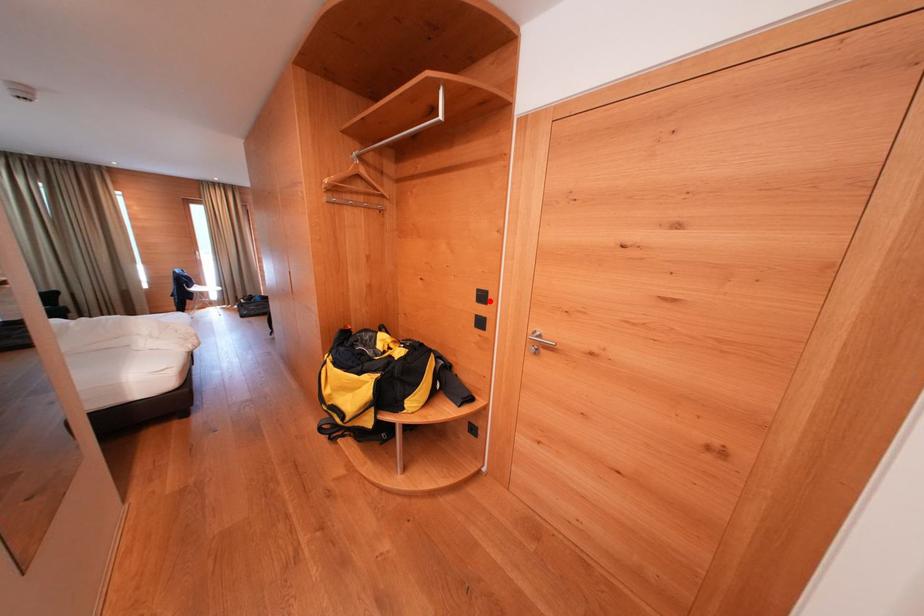
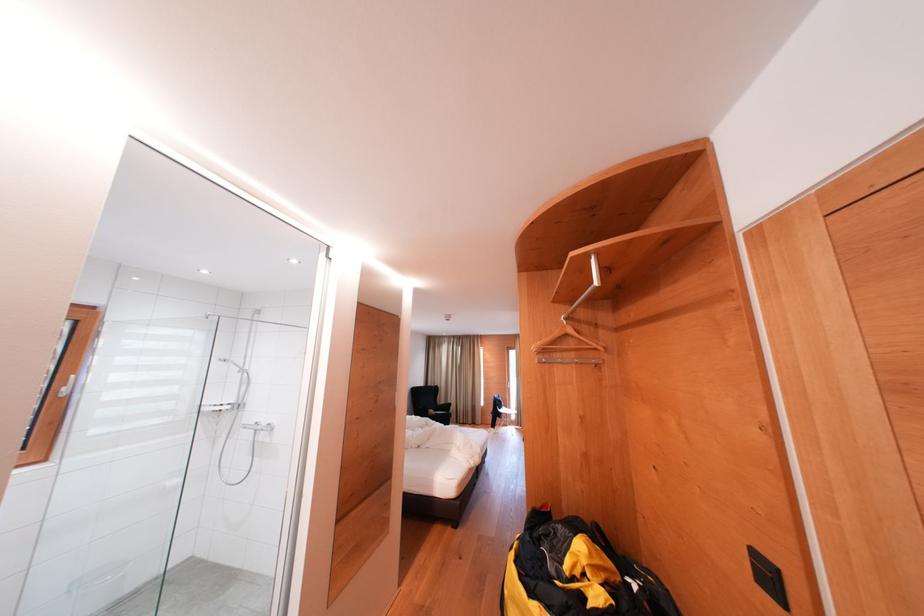
Find the pixel in the second image that matches the highlighted location in the first image.

(776, 582)